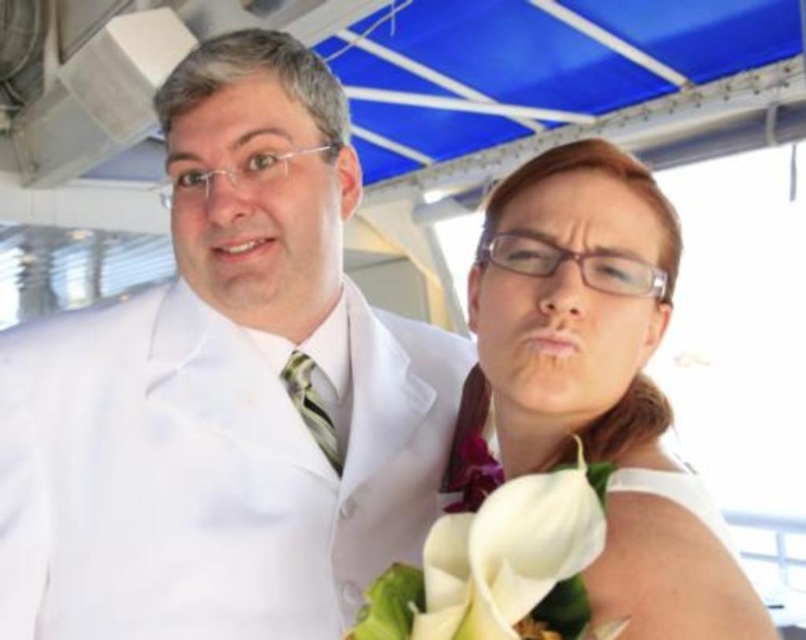
Question: Which point is closer to the camera?

Choices:
 (A) white satin dress at center
 (B) white matte suit at center

Answer: (A)

Question: Observing the image, what is the correct spatial positioning of white matte suit at center in reference to white matte calla lilies at center?

Choices:
 (A) right
 (B) left

Answer: (B)

Question: Considering the real-world distances, which object is closest to the white matte suit at center?

Choices:
 (A) white satin dress at center
 (B) white matte calla lilies at center

Answer: (A)

Question: Does white matte suit at center have a smaller size compared to white matte calla lilies at center?

Choices:
 (A) no
 (B) yes

Answer: (A)

Question: Estimate the real-world distances between objects in this image. Which object is farther from the white matte suit at center?

Choices:
 (A) white matte calla lilies at center
 (B) white satin dress at center

Answer: (A)

Question: Observing the image, what is the correct spatial positioning of white matte suit at center in reference to white matte calla lilies at center?

Choices:
 (A) left
 (B) right

Answer: (A)